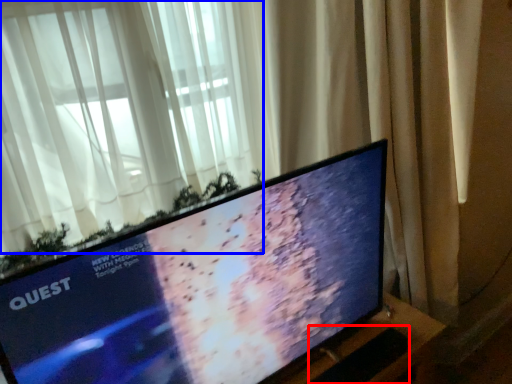
Question: Which of the following is the closest to the observer, laptop keyboard (highlighted by a red box) or curtain (highlighted by a blue box)?

Choices:
 (A) laptop keyboard
 (B) curtain

Answer: (B)